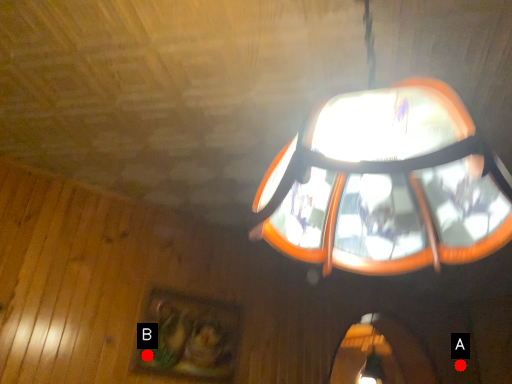
Question: Two points are circled on the image, labeled by A and B beside each circle. Which point is closer to the camera?

Choices:
 (A) A is closer
 (B) B is closer

Answer: (B)